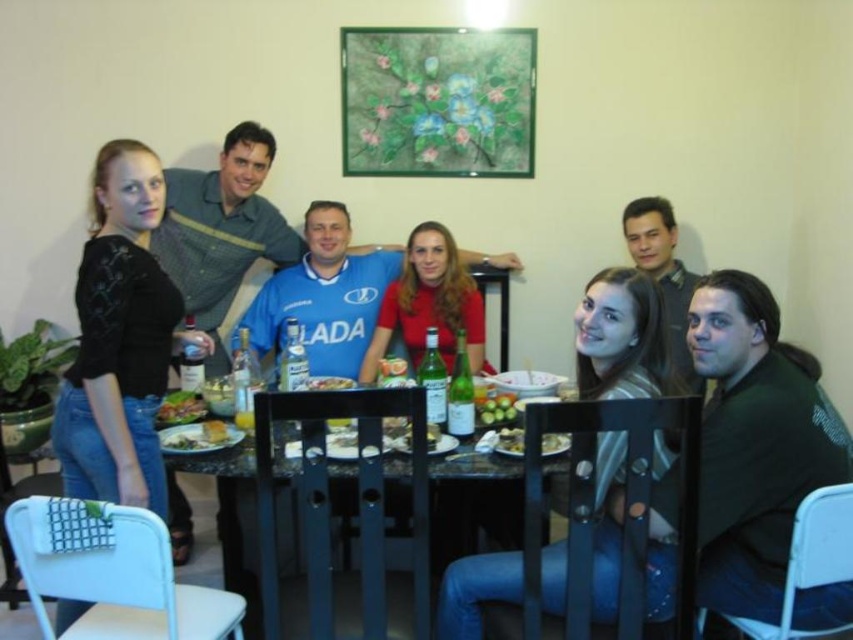
Question: Considering the real-world distances, which object is farthest from the smooth yellow bread at center?

Choices:
 (A) black glass table at center
 (B) green leafy salad at center
 (C) green leafy salad at table center
 (D) smooth white bread at table center

Answer: (B)

Question: Estimate the real-world distances between objects in this image. Which object is farther from the green matte grapes at center?

Choices:
 (A) smooth white bread at table center
 (B) smooth yellow bread at center
 (C) matte red shirt at center
 (D) green leafy salad at center

Answer: (A)

Question: Is green matte grapes at center to the left of smooth yellow bread at center from the viewer's perspective?

Choices:
 (A) yes
 (B) no

Answer: (B)

Question: Which object is closer to the camera taking this photo?

Choices:
 (A) green leafy salad at table center
 (B) black glass table at center
 (C) matte red shirt at center
 (D) smooth yellow bread at center

Answer: (B)

Question: Observing the image, what is the correct spatial positioning of green leafy salad at table center in reference to green leafy salad at center?

Choices:
 (A) left
 (B) right

Answer: (A)

Question: Does smooth plastic bowl at center appear on the left side of smooth white plate at center?

Choices:
 (A) no
 (B) yes

Answer: (B)